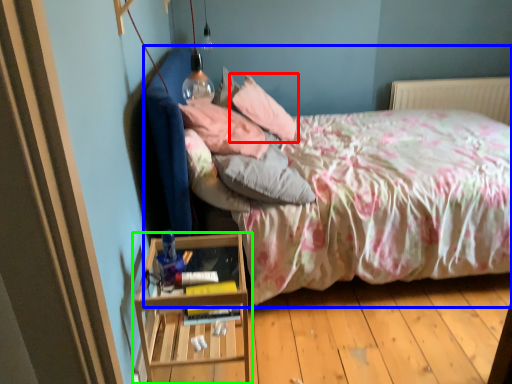
Question: Estimate the real-world distances between objects in this image. Which object is closer to pillow (highlighted by a red box), bed (highlighted by a blue box) or nightstand (highlighted by a green box)?

Choices:
 (A) bed
 (B) nightstand

Answer: (A)